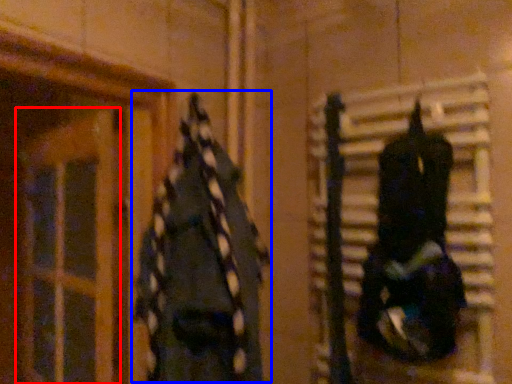
Question: Which object is closer to the camera taking this photo, glass door (highlighted by a red box) or clothing (highlighted by a blue box)?

Choices:
 (A) glass door
 (B) clothing

Answer: (B)